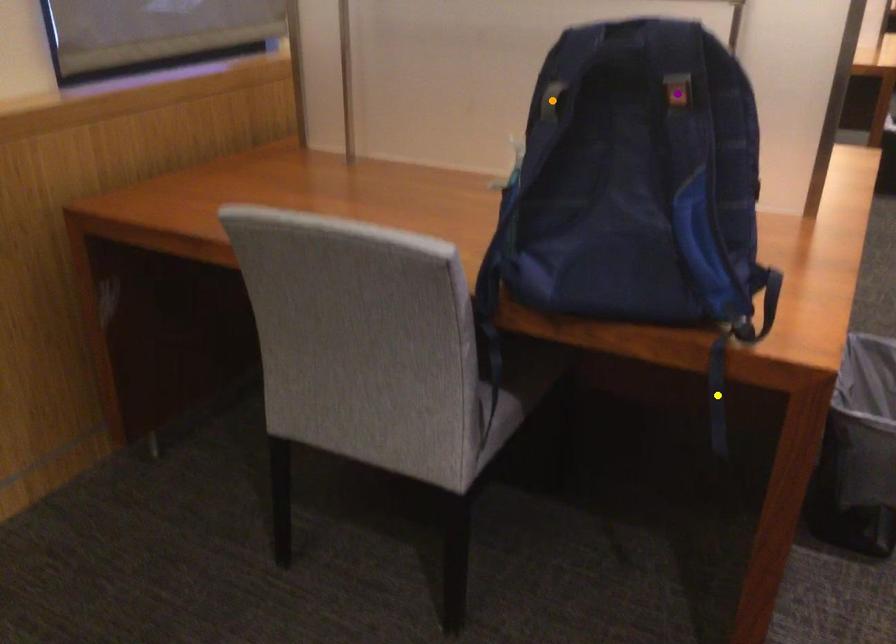
Order these from nearest to farthest:
yellow point
orange point
purple point

1. purple point
2. yellow point
3. orange point